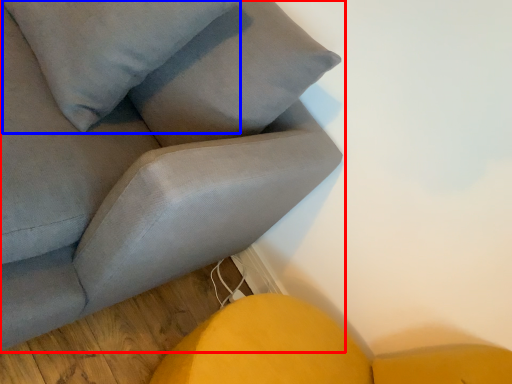
Question: Which object appears farthest to the camera in this image, studio couch (highlighted by a red box) or pillow (highlighted by a blue box)?

Choices:
 (A) studio couch
 (B) pillow

Answer: (B)